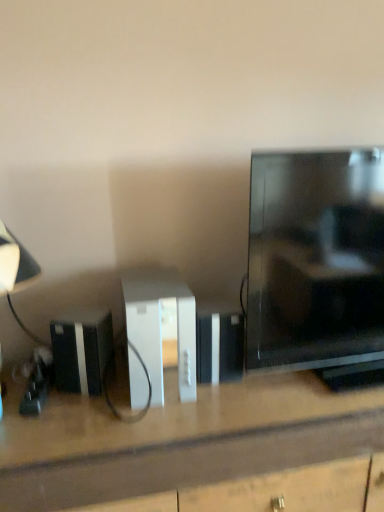
Question: Does black glossy tv at right have a lesser height compared to black plastic speaker at lower left?

Choices:
 (A) yes
 (B) no

Answer: (B)

Question: From a real-world perspective, is black glossy tv at right below black plastic speaker at lower left?

Choices:
 (A) yes
 (B) no

Answer: (B)

Question: Is black glossy tv at right closer to the viewer compared to black plastic speaker at lower left?

Choices:
 (A) no
 (B) yes

Answer: (B)

Question: Is black plastic speaker at lower left a part of black glossy tv at right?

Choices:
 (A) yes
 (B) no

Answer: (B)

Question: Considering the relative sizes of black glossy tv at right and black plastic speaker at lower left in the image provided, is black glossy tv at right thinner than black plastic speaker at lower left?

Choices:
 (A) yes
 (B) no

Answer: (B)

Question: Does black glossy tv at right have a larger size compared to black plastic speaker at lower left?

Choices:
 (A) yes
 (B) no

Answer: (A)

Question: Can you confirm if black plastic speaker at lower left is wider than matte black lampshade at left?

Choices:
 (A) no
 (B) yes

Answer: (A)

Question: Can you confirm if black plastic speaker at lower left is taller than matte black lampshade at left?

Choices:
 (A) yes
 (B) no

Answer: (B)

Question: Is black plastic speaker at lower left behind matte black lampshade at left?

Choices:
 (A) no
 (B) yes

Answer: (B)

Question: From the image's perspective, is black plastic speaker at lower left on matte black lampshade at left?

Choices:
 (A) yes
 (B) no

Answer: (B)

Question: From a real-world perspective, is black plastic speaker at lower left positioned under matte black lampshade at left based on gravity?

Choices:
 (A) no
 (B) yes

Answer: (B)

Question: From a real-world perspective, is black plastic speaker at lower left on top of matte black lampshade at left?

Choices:
 (A) no
 (B) yes

Answer: (A)

Question: Can you confirm if matte black lampshade at left is thinner than black plastic speaker at lower left?

Choices:
 (A) no
 (B) yes

Answer: (A)